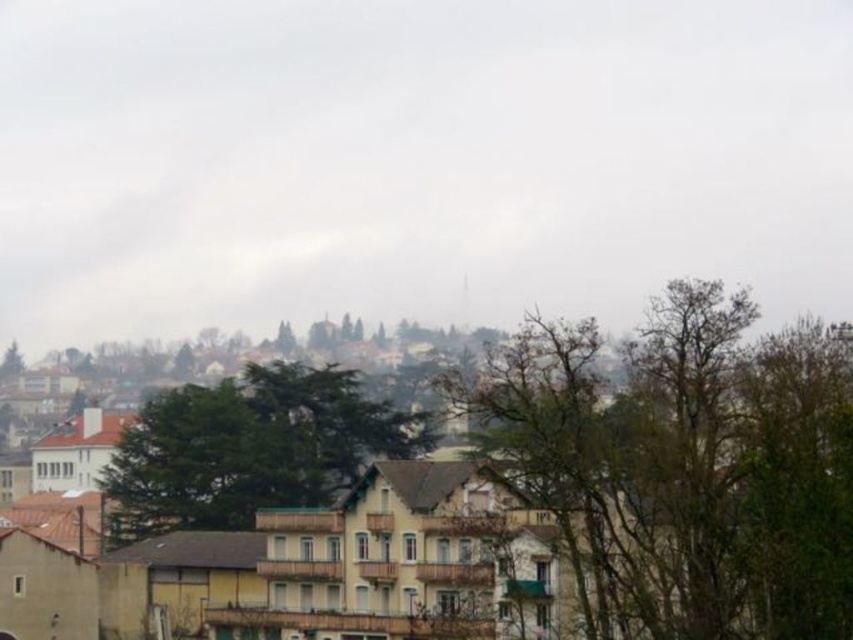
Question: Where is brown leafless tree at center located in relation to green leafy tree at center in the image?

Choices:
 (A) above
 (B) below

Answer: (A)

Question: Which of the following is the closest to the observer?

Choices:
 (A) (718, 589)
 (B) (164, 515)

Answer: (A)

Question: Which of the following is the closest to the observer?

Choices:
 (A) (751, 349)
 (B) (183, 467)

Answer: (A)

Question: Is brown leafless tree at center below green leafy tree at center?

Choices:
 (A) yes
 (B) no

Answer: (B)

Question: In this image, where is yellow matte building at center located relative to green leafy tree at center?

Choices:
 (A) right
 (B) left

Answer: (A)

Question: Among these objects, which one is farthest from the camera?

Choices:
 (A) brown leafless tree at center
 (B) yellow matte building at center
 (C) green leafy tree at center

Answer: (C)